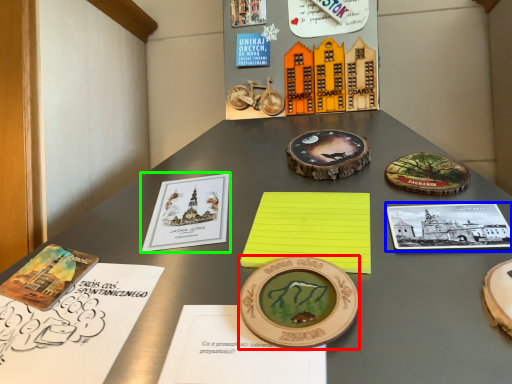
Question: Which object is the closest to the coin (highlighted by a red box)? Choose among these: book (highlighted by a blue box) or book (highlighted by a green box).

Choices:
 (A) book
 (B) book

Answer: (A)